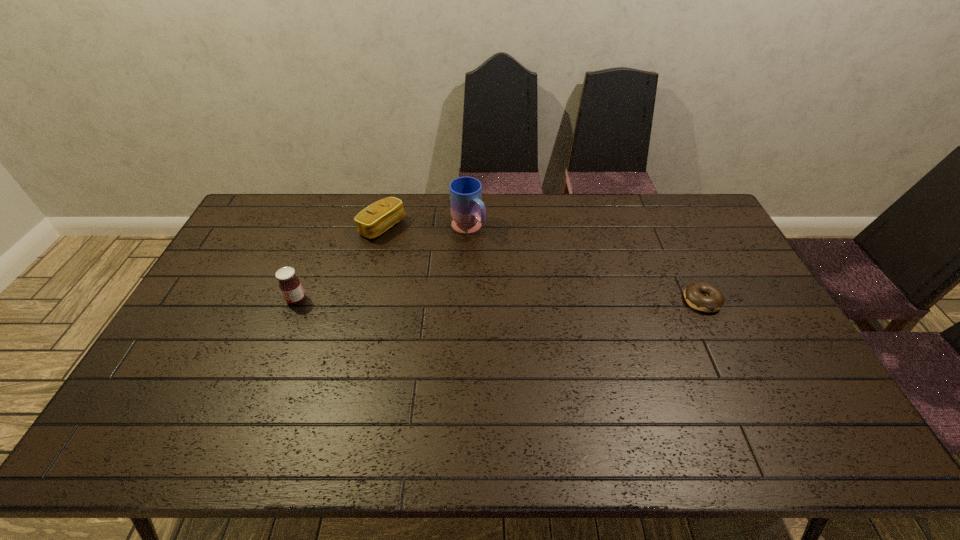
Identify the location of vacant area that lies between the second tallest object and the second object from left to right. The image size is (960, 540). (339, 264).

Where is `vacant area that lies between the second shortest object and the second tallest object`? vacant area that lies between the second shortest object and the second tallest object is located at coordinates (339, 264).

This screenshot has width=960, height=540. I want to click on empty space between the mug and the third tallest object, so click(425, 228).

Identify the location of vacant space that is in between the mug and the clutch bag. This screenshot has width=960, height=540. click(x=425, y=228).

This screenshot has width=960, height=540. Identify the location of vacant area between the doughnut and the third tallest object. (542, 264).

Identify the location of blank region between the clutch bag and the doughnut. [x=542, y=264].

Locate which object is the closest to the tallest object. Please provide its 2D coordinates. Your answer should be formatted as a tuple, i.e. [(x, y)], where the tuple contains the x and y coordinates of a point satisfying the conditions above.

[(380, 216)]

Select which object appears as the closest to the third object from right to left. Please provide its 2D coordinates. Your answer should be formatted as a tuple, i.e. [(x, y)], where the tuple contains the x and y coordinates of a point satisfying the conditions above.

[(468, 212)]

This screenshot has width=960, height=540. Find the location of `free space that satisfies the following two spatial constraints: 1. on the front side of the rightmost object; 2. on the right side of the clutch bag`. free space that satisfies the following two spatial constraints: 1. on the front side of the rightmost object; 2. on the right side of the clutch bag is located at coordinates (364, 301).